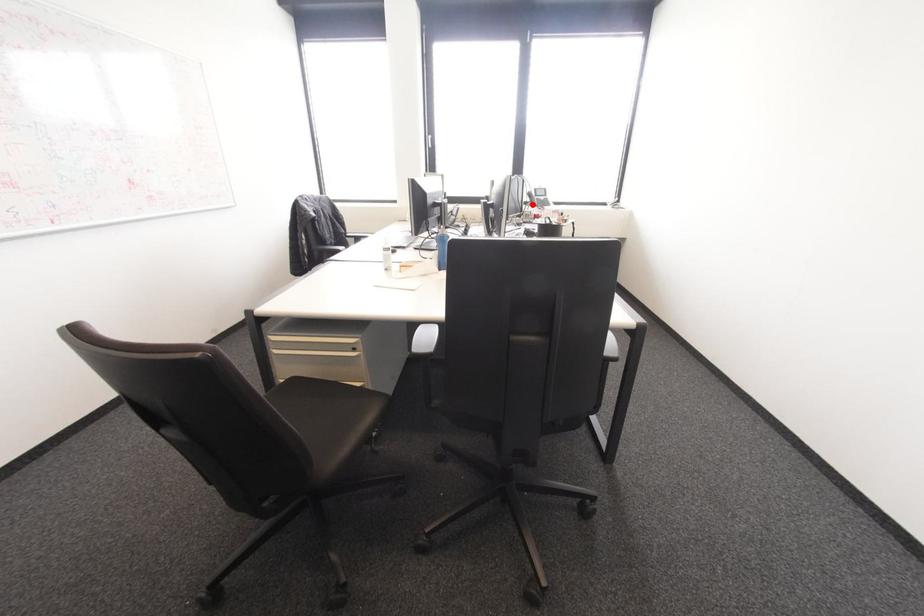
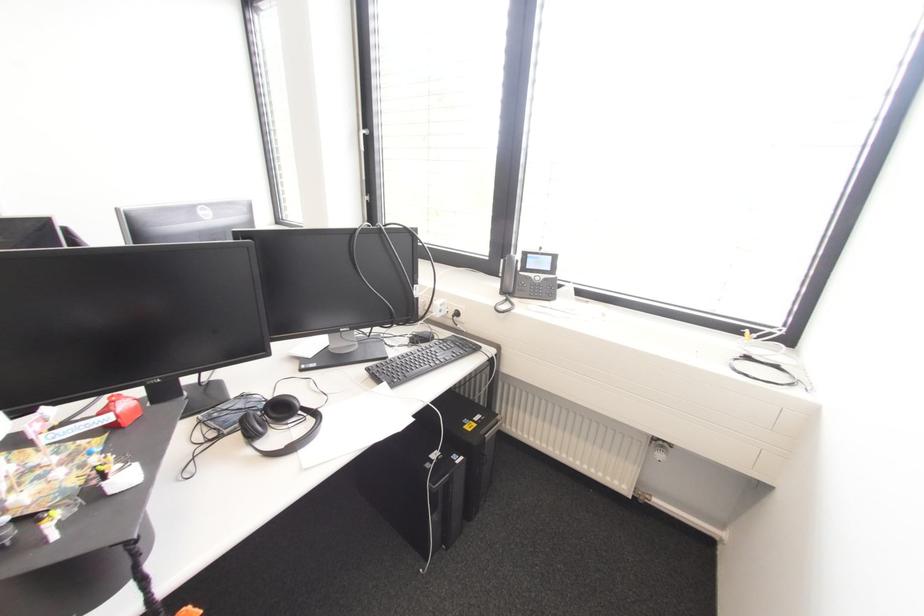
Question: I am providing you with two images of the same scene from different viewpoints. Image1 has a red point marked. In image2, the corresponding 3D location appears at what relative position? Reply with the corresponding letter.

Choices:
 (A) Closer
 (B) Farther

Answer: (B)